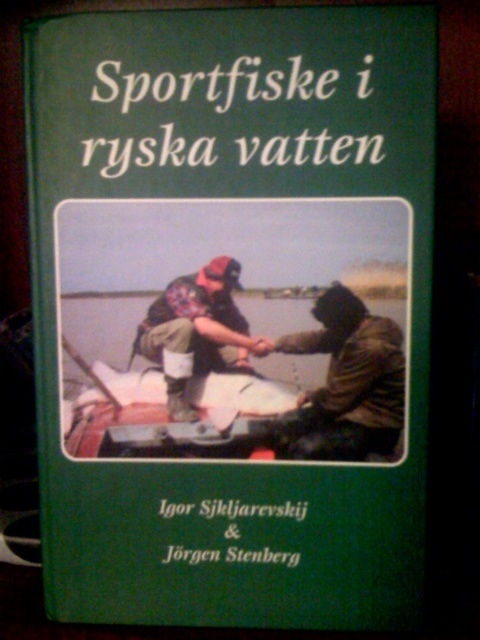
How distant is dark green hooded jacket at center from camouflage fabric shirt at center?

dark green hooded jacket at center is 6.86 centimeters from camouflage fabric shirt at center.

Does dark green hooded jacket at center have a smaller size compared to camouflage fabric shirt at center?

Correct, dark green hooded jacket at center occupies less space than camouflage fabric shirt at center.

Is point (388, 355) farther from camera compared to point (166, 365)?

No, it is not.

This screenshot has height=640, width=480. I want to click on dark green hooded jacket at center, so click(348, 381).